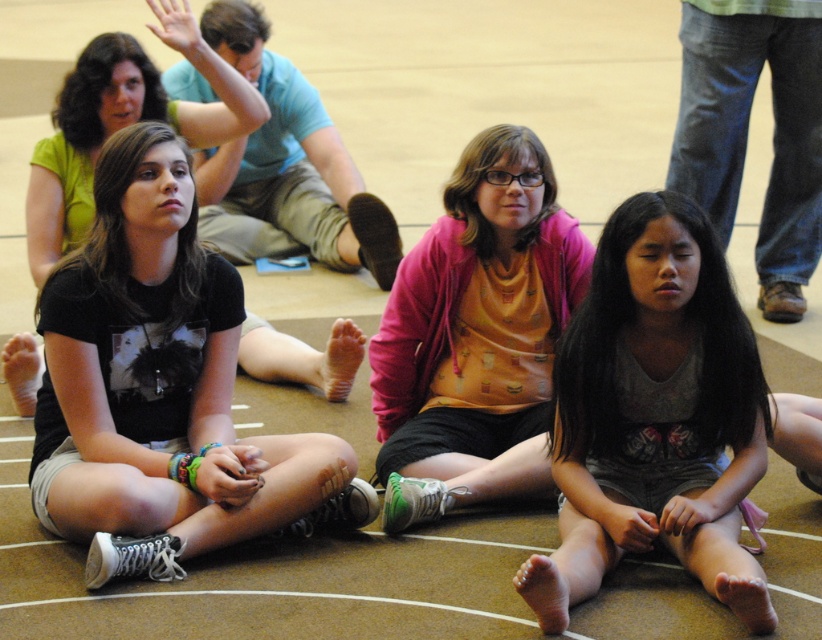
Between gray cotton shorts at lower right and orange matte shirt at center, which one appears on the right side from the viewer's perspective?

Positioned to the right is gray cotton shorts at lower right.

Which of these two, gray cotton shorts at lower right or orange matte shirt at center, stands shorter?

Standing shorter between the two is gray cotton shorts at lower right.

Find the location of a particular element. The image size is (822, 640). gray cotton shorts at lower right is located at coordinates (654, 417).

Consider the image. Does black fabric shirt at center have a larger size compared to orange matte shirt at center?

Correct, black fabric shirt at center is larger in size than orange matte shirt at center.

Who is taller, black fabric shirt at center or orange matte shirt at center?

black fabric shirt at center is taller.

The height and width of the screenshot is (640, 822). Find the location of `black fabric shirt at center`. black fabric shirt at center is located at coordinates (158, 387).

Based on the photo, is black fabric shirt at center positioned in front of gray cotton shorts at lower right?

That is False.

Between black fabric shirt at center and gray cotton shorts at lower right, which one has more height?

Standing taller between the two is black fabric shirt at center.

Is point (174, 534) behind point (640, 419)?

No.

At what (x,y) coordinates should I click in order to perform the action: click on black fabric shirt at center. Please return your answer as a coordinate pair (x, y). This screenshot has width=822, height=640. Looking at the image, I should click on (158, 387).